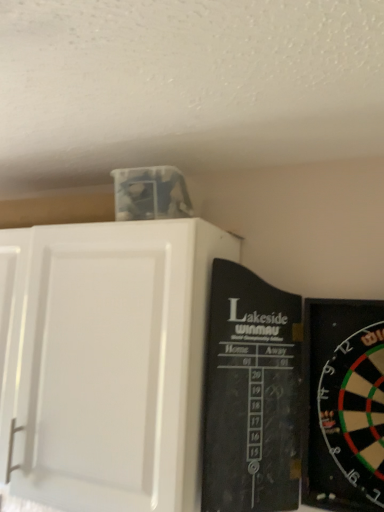
Question: From a real-world perspective, is white matte cabinet at upper left above or below black plastic dartboard at right?

Choices:
 (A) above
 (B) below

Answer: (A)

Question: Relative to black plastic dartboard at right, is white matte cabinet at upper left in front or behind?

Choices:
 (A) behind
 (B) front

Answer: (A)

Question: Would you say white matte cabinet at upper left is to the left or to the right of black plastic dartboard at right in the picture?

Choices:
 (A) right
 (B) left

Answer: (B)

Question: From a real-world perspective, relative to white matte cabinet at upper left, is black plastic dartboard at right vertically above or below?

Choices:
 (A) above
 (B) below

Answer: (B)

Question: From their relative heights in the image, would you say black plastic dartboard at right is taller or shorter than white matte cabinet at upper left?

Choices:
 (A) short
 (B) tall

Answer: (A)

Question: Is black plastic dartboard at right inside or outside of white matte cabinet at upper left?

Choices:
 (A) inside
 (B) outside

Answer: (B)

Question: From the image's perspective, is black plastic dartboard at right above or below white matte cabinet at upper left?

Choices:
 (A) below
 (B) above

Answer: (A)